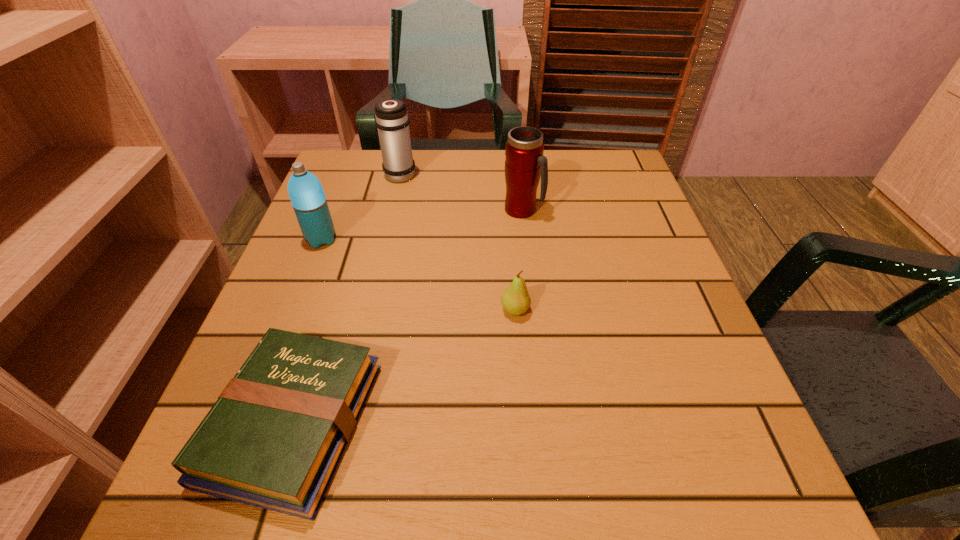
Identify the location of unoccupied position between the third nearest object and the farthest thermos bottle. (361, 206).

You are a GUI agent. You are given a task and a screenshot of the screen. Output one action in this format:
    pyautogui.click(x=<x>, y=<y>)
    Task: Click on the free space between the fourth tallest object and the nearest object
    The height and width of the screenshot is (540, 960).
    Given the screenshot: What is the action you would take?
    pyautogui.click(x=404, y=366)

Locate an element on the screen. Image resolution: width=960 pixels, height=540 pixels. vacant area that lies between the second thermos bottle from left to right and the third farthest object is located at coordinates (361, 206).

At what (x,y) coordinates should I click in order to perform the action: click on blank region between the second thermos bottle from right to left and the second nearest object. Please return your answer as a coordinate pair (x, y). The height and width of the screenshot is (540, 960). Looking at the image, I should click on tap(458, 242).

The height and width of the screenshot is (540, 960). Find the location of `object that is the third nearest to the book`. object that is the third nearest to the book is located at coordinates (525, 163).

Find the location of a particular element. This screenshot has width=960, height=540. the fourth closest object to the second farthest object is located at coordinates (274, 438).

Identify the location of thermos bottle that is the closest to the second shortest object. This screenshot has height=540, width=960. (525, 163).

Find the location of a particular element. This screenshot has width=960, height=540. thermos bottle that is the second nearest to the farthest object is located at coordinates (525, 163).

Locate an element on the screen. The width and height of the screenshot is (960, 540). free spot that satisfies the following two spatial constraints: 1. on the front side of the fourth tallest object; 2. on the left side of the nearest thermos bottle is located at coordinates [x=293, y=310].